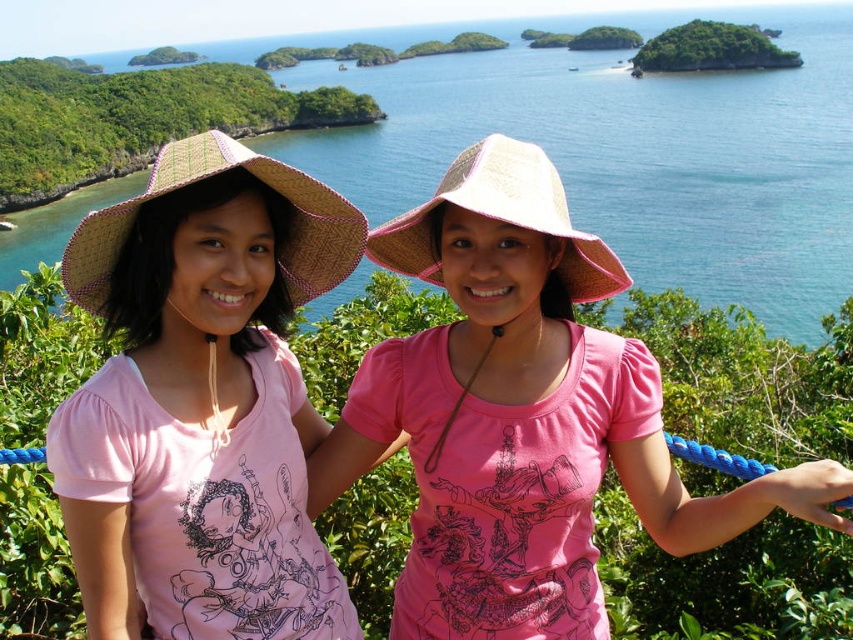
Based on the scene description, where is the pink woven hat at center located in terms of coordinates?

The pink woven hat at center is located at coordinates point (523,417).

You are an observer looking at the scene. Which object has a smaller width between the pink woven hat at center and the green leafy vegetation at upper left?

The pink woven hat at center has a lesser width compared to the green leafy vegetation at upper left.